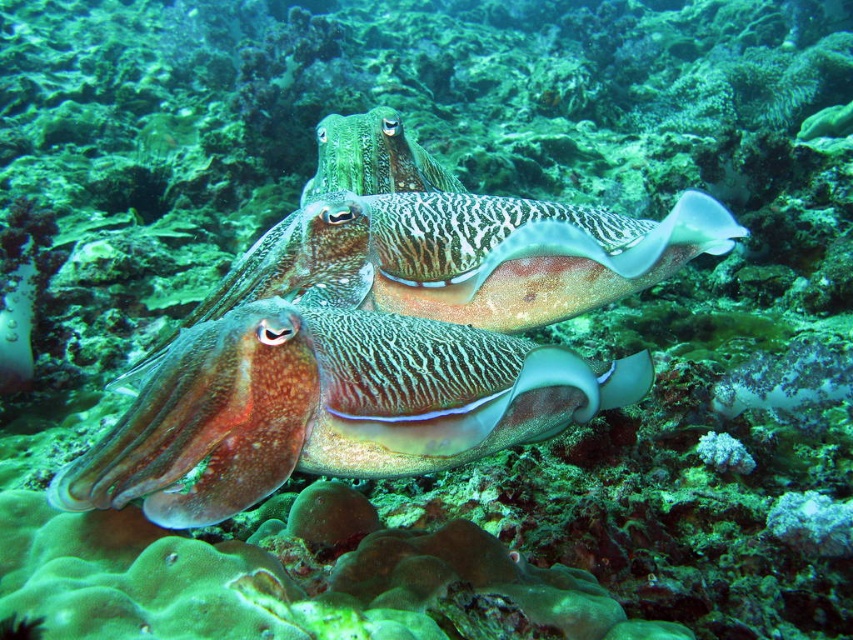
You are an underwater photographer aiming to capture both the smooth brown squid at center and the green textured squid at center in a single frame. Given that your camera can only focus on objects within a 10 cm width range, can you adjust your camera settings to include both squids in focus?

The smooth brown squid at center is narrower than the green textured squid at center. Since the camera can focus on objects within a 10 cm width range, and the difference in their widths is less than 10 cm, you can adjust your camera settings to include both squids in focus.

Looking at this image, you are a marine biologist observing two squids underwater. You have a measuring tool that can measure distances up to 20 centimeters. Can you determine if the smooth brown squid at center and the green textured squid at center are within range of your tool?

The smooth brown squid at center is 18.38 centimeters away from the green textured squid at center. Since your measuring tool can measure up to 20 centimeters, the distance between them is within the tool range.

You are a marine biologist observing two squids in the center of the coral reef. Which one is positioned to the left side between the smooth brown squid at center and the green textured squid at center?

The smooth brown squid at center is positioned to the left of the green textured squid at center.